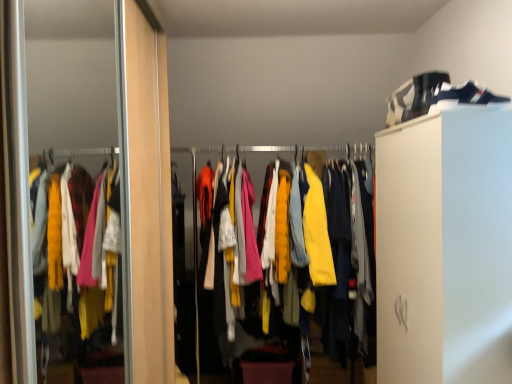
Question: Is point (431, 86) closer or farther from the camera than point (139, 54)?

Choices:
 (A) farther
 (B) closer

Answer: (B)

Question: Is camouflage fabric shoe at upper right to the left or to the right of wooden screen door at left in the image?

Choices:
 (A) right
 (B) left

Answer: (A)

Question: Considering the real-world distances, which object is farthest from the camouflage fabric shoe at upper right?

Choices:
 (A) matte yellow jackets at center
 (B) wooden screen door at left

Answer: (B)

Question: Based on their relative distances, which object is nearer to the camouflage fabric shoe at upper right?

Choices:
 (A) wooden screen door at left
 (B) matte yellow jackets at center

Answer: (B)